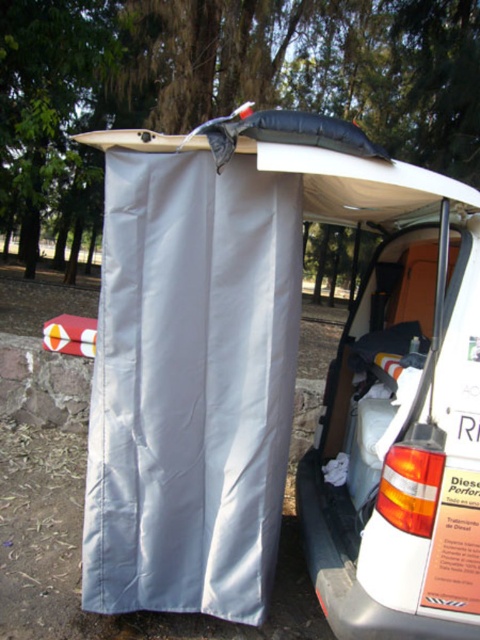
From the picture: You are planning to set up a temporary shelter using the white fabric curtain at center and the white foam surfboard at center. Considering their sizes, which object would you use as the base structure for the shelter?

The white foam surfboard at center is larger than the white fabric curtain at center, so it would be more suitable as the base structure for the shelter.

You are standing in front of the makeshift structure next to the parked vehicle. There are two points marked on the structure. One is at coordinates point (200,234) and the other is at point (300,161). Which point is closer to you?

Point (300,161) is closer to you because it is less further to the camera than point (200,234).

You are setting up a temporary shelter using the white fabric curtain at center and the white foam surfboard at center. Based on the scene, can you determine if the surfboard is positioned in front of or behind the curtain?

The white foam surfboard at center is behind the white fabric curtain at center, so the surfboard is positioned behind the curtain.